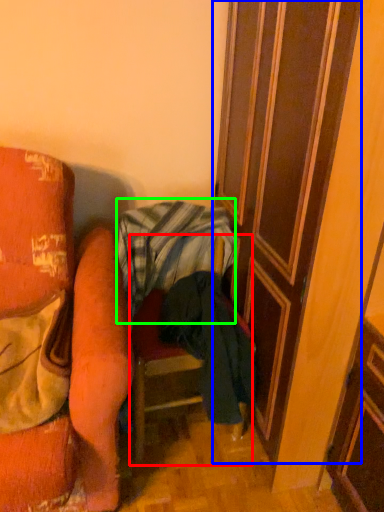
Question: Estimate the real-world distances between objects in this image. Which object is closer to furniture (highlighted by a red box), door (highlighted by a blue box) or blanket (highlighted by a green box)?

Choices:
 (A) door
 (B) blanket

Answer: (B)